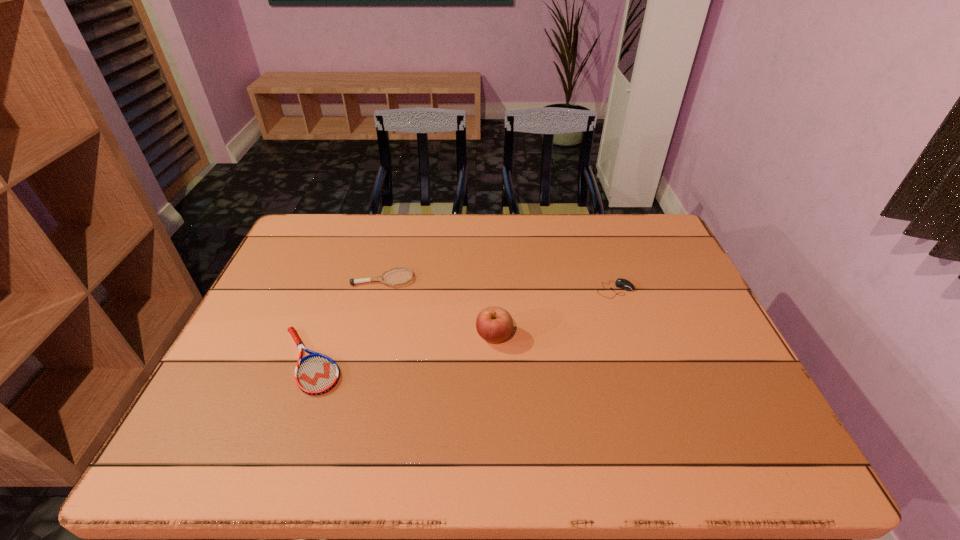
I want to click on free space in the image that satisfies the following two spatial constraints: 1. on the back side of the shortest object; 2. on the left side of the taller tennis racket, so click(x=340, y=279).

Where is `vacant region that satisfies the following two spatial constraints: 1. on the front side of the taller tennis racket; 2. on the right side of the third object from left to right`? The image size is (960, 540). vacant region that satisfies the following two spatial constraints: 1. on the front side of the taller tennis racket; 2. on the right side of the third object from left to right is located at coordinates 369,336.

You are a GUI agent. You are given a task and a screenshot of the screen. Output one action in this format:
    pyautogui.click(x=<x>, y=<y>)
    Task: Click on the blank space that satisfies the following two spatial constraints: 1. on the front side of the farther tennis racket; 2. on the left side of the computer mouse
    
    Given the screenshot: What is the action you would take?
    pyautogui.click(x=380, y=289)